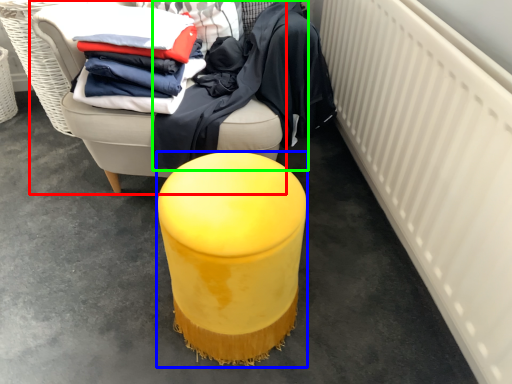
Question: Which object is the closest to the furniture (highlighted by a red box)? Choose among these: furniture (highlighted by a blue box) or clothing (highlighted by a green box).

Choices:
 (A) furniture
 (B) clothing

Answer: (B)